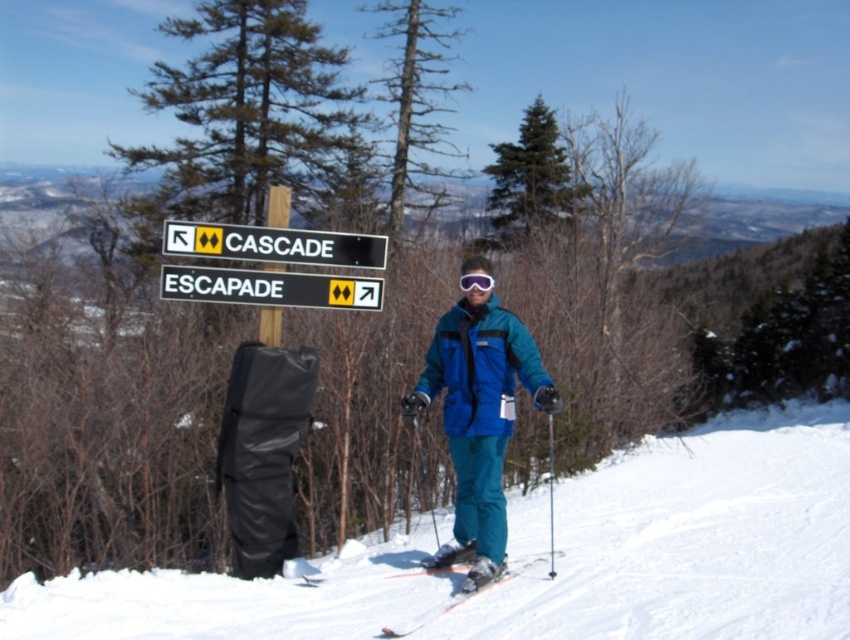
You are a skier at the signpost and want to choose between the two trails. The trail named CASCADE is located at point [431,612] and the trail named ESCAPADE is located at point [472,282]. Which trail is closer to you?

The trail named CASCADE at point [431,612] is closer to you because point [431,612] is closer to the viewer than point [472,282].

From the picture: You are a skier planning to descend the slope. You see the blue fabric ski slope at center and the teal matte ski suit at center. Which object is positioned lower in the image?

The blue fabric ski slope at center is positioned below the teal matte ski suit at center, so the blue fabric ski slope at center is lower in the image.

You are a skier preparing to read the signpost. The black plastic sign at upper center and the purple matte goggles at center are both in your line of sight. Which object is wider?

The black plastic sign at upper center is wider than the purple matte goggles at center.